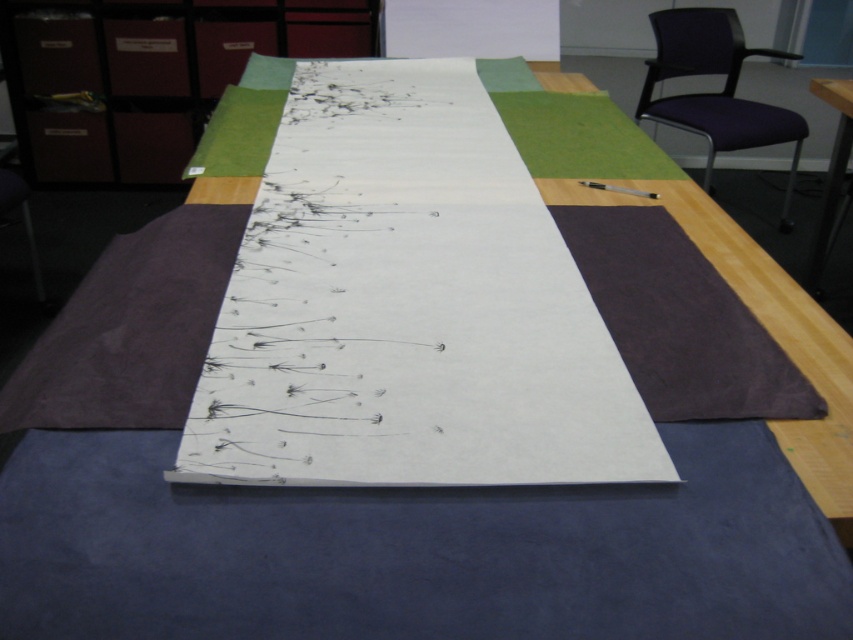
Between white paper at center and wooden table at right, which one is positioned higher?

wooden table at right is above.

Is white paper at center thinner than wooden table at right?

No.

Is point (567, 280) positioned in front of point (840, 109)?

Yes, it is.

The height and width of the screenshot is (640, 853). What are the coordinates of `white paper at center` in the screenshot? It's located at (407, 307).

Does white paper at center appear under matte brown file cabinet at upper left?

Indeed, white paper at center is positioned under matte brown file cabinet at upper left.

Does white paper at center lie behind matte brown file cabinet at upper left?

No, white paper at center is in front of matte brown file cabinet at upper left.

Describe the element at coordinates (407, 307) in the screenshot. I see `white paper at center` at that location.

Image resolution: width=853 pixels, height=640 pixels. I want to click on white paper at center, so (x=407, y=307).

Is purple fabric chair at upper right above wooden table at right?

Indeed, purple fabric chair at upper right is positioned over wooden table at right.

Which is below, purple fabric chair at upper right or wooden table at right?

Positioned lower is wooden table at right.

This screenshot has width=853, height=640. Find the location of `purple fabric chair at upper right`. purple fabric chair at upper right is located at coordinates (715, 92).